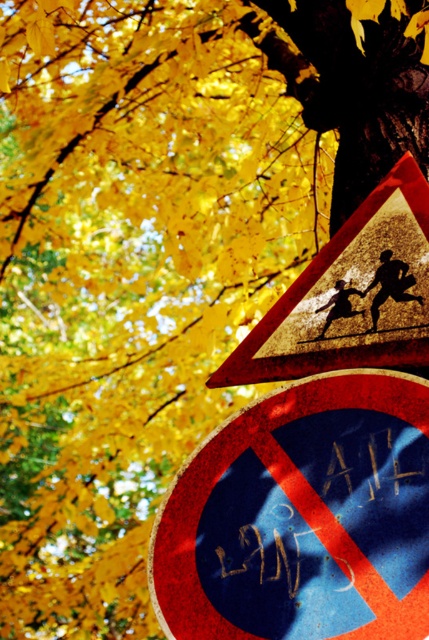
Question: Which point appears farthest from the camera in this image?

Choices:
 (A) (247, 456)
 (B) (308, 268)

Answer: (B)

Question: Which of these objects is positioned closest to the rusty metal sign at lower center?

Choices:
 (A) dark blue paper at center
 (B) metallic reflective triangle at upper center

Answer: (A)

Question: Can you confirm if rusty metal sign at lower center is positioned to the right of metallic reflective triangle at upper center?

Choices:
 (A) no
 (B) yes

Answer: (A)

Question: Which point appears closest to the camera in this image?

Choices:
 (A) (368, 545)
 (B) (287, 483)
 (C) (410, 180)

Answer: (A)

Question: Can you confirm if dark blue paper at center is bigger than metallic reflective triangle at upper center?

Choices:
 (A) no
 (B) yes

Answer: (A)

Question: Does dark blue paper at center have a greater width compared to metallic reflective triangle at upper center?

Choices:
 (A) yes
 (B) no

Answer: (B)